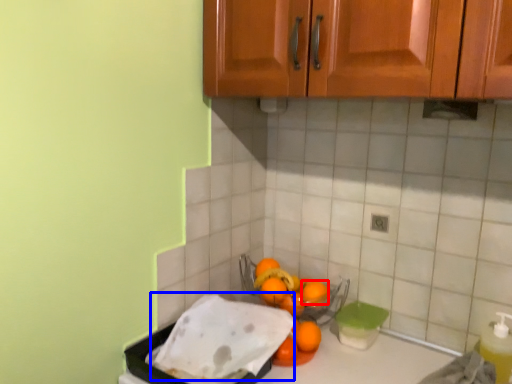
Question: Which object appears farthest to the camera in this image, orange (highlighted by a red box) or wash (highlighted by a blue box)?

Choices:
 (A) orange
 (B) wash

Answer: (A)